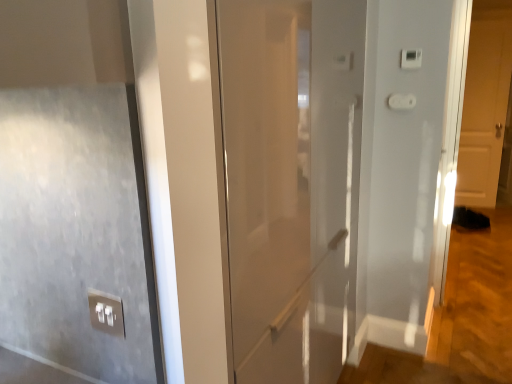
The height and width of the screenshot is (384, 512). What do you see at coordinates (106, 312) in the screenshot? I see `satin silver switch at lower left` at bounding box center [106, 312].

Image resolution: width=512 pixels, height=384 pixels. I want to click on white glossy door at center, which ranks as the first door in front-to-back order, so click(x=291, y=181).

The height and width of the screenshot is (384, 512). What do you see at coordinates (401, 101) in the screenshot?
I see `white plastic light switch at upper right, the 2th light switch in the top-to-bottom sequence` at bounding box center [401, 101].

Describe the element at coordinates (485, 103) in the screenshot. I see `white matte door at right, arranged as the 1th door when viewed from the back` at that location.

This screenshot has height=384, width=512. I want to click on satin silver switch at lower left, so click(106, 312).

From the picture: Is satin silver switch at lower left positioned beyond the bounds of white glossy door at center, marked as the 1th door in a left-to-right arrangement?

satin silver switch at lower left lies outside white glossy door at center, marked as the 1th door in a left-to-right arrangement,'s area.

Consider the image. Can you confirm if satin silver switch at lower left is shorter than white glossy door at center, which ranks as the first door in front-to-back order?

Correct, satin silver switch at lower left is not as tall as white glossy door at center, which ranks as the first door in front-to-back order.

Can you confirm if satin silver switch at lower left is thinner than white glossy door at center, the second door in the back-to-front sequence?

Indeed, satin silver switch at lower left has a lesser width compared to white glossy door at center, the second door in the back-to-front sequence.

Between satin silver switch at lower left and white glossy door at center, which ranks as the first door in front-to-back order, which one has smaller size?

Smaller between the two is satin silver switch at lower left.

Is the depth of satin silver switch at lower left greater than that of white plastic light switch at upper right, the 1th light switch ordered from the bottom?

No, satin silver switch at lower left is in front of white plastic light switch at upper right, the 1th light switch ordered from the bottom.

Measure the distance from satin silver switch at lower left to white plastic light switch at upper right, the 1th light switch ordered from the bottom.

satin silver switch at lower left is 5.67 feet away from white plastic light switch at upper right, the 1th light switch ordered from the bottom.

Is satin silver switch at lower left to the right of white plastic light switch at upper right, the 2th light switch in the top-to-bottom sequence, from the viewer's perspective?

Incorrect, satin silver switch at lower left is not on the right side of white plastic light switch at upper right, the 2th light switch in the top-to-bottom sequence.

Considering the relative sizes of satin silver switch at lower left and white plastic light switch at upper right, acting as the 1th light switch starting from the top, in the image provided, is satin silver switch at lower left smaller than white plastic light switch at upper right, acting as the 1th light switch starting from the top,?

Yes, satin silver switch at lower left is smaller than white plastic light switch at upper right, acting as the 1th light switch starting from the top.

Does point (90, 309) appear closer or farther from the camera than point (409, 57)?

Point (90, 309) appears to be closer to the viewer than point (409, 57).

How different are the orientations of satin silver switch at lower left and white plastic light switch at upper right, acting as the 1th light switch starting from the top, in degrees?

2.52 degrees.

Considering the relative sizes of satin silver switch at lower left and white plastic light switch at upper right, acting as the second light switch starting from the bottom, in the image provided, is satin silver switch at lower left shorter than white plastic light switch at upper right, acting as the second light switch starting from the bottom,?

Yes.

Considering the points (465, 203) and (418, 61), which point is behind, point (465, 203) or point (418, 61)?

The point (465, 203) is farther from the camera.

Image resolution: width=512 pixels, height=384 pixels. In order to click on the 1st door directly beneath the white plastic light switch at upper right, acting as the 1th light switch starting from the top (from a real-world perspective) in this screenshot , I will do point(485,103).

Who is shorter, white matte door at right, arranged as the first door when viewed from the right, or white plastic light switch at upper right, acting as the second light switch starting from the bottom?

Standing shorter between the two is white plastic light switch at upper right, acting as the second light switch starting from the bottom.

Is white matte door at right, arranged as the first door when viewed from the right, turned away from white plastic light switch at upper right, acting as the second light switch starting from the bottom?

No, white plastic light switch at upper right, acting as the second light switch starting from the bottom, is not at the back of white matte door at right, arranged as the first door when viewed from the right.

Can you tell me how much white glossy door at center, the second door in the back-to-front sequence, and white matte door at right, arranged as the first door when viewed from the right, differ in facing direction?

There is a 88.4-degree angle between the facing directions of white glossy door at center, the second door in the back-to-front sequence, and white matte door at right, arranged as the first door when viewed from the right.

Is white glossy door at center, which ranks as the first door in front-to-back order, oriented towards white matte door at right, arranged as the first door when viewed from the right?

No, white glossy door at center, which ranks as the first door in front-to-back order, is not turned towards white matte door at right, arranged as the first door when viewed from the right.

Based on the photo, relative to white matte door at right, arranged as the first door when viewed from the right, is white glossy door at center, which ranks as the first door in front-to-back order, in front or behind?

Clearly, white glossy door at center, which ranks as the first door in front-to-back order, is in front of white matte door at right, arranged as the first door when viewed from the right.

Locate an element on the screen. This screenshot has width=512, height=384. door in front of the white plastic light switch at upper right, acting as the 1th light switch starting from the top is located at coordinates (291, 181).

Could you tell me if white glossy door at center, marked as the 1th door in a left-to-right arrangement, is facing white plastic light switch at upper right, acting as the 1th light switch starting from the top?

No, white glossy door at center, marked as the 1th door in a left-to-right arrangement, is not turned towards white plastic light switch at upper right, acting as the 1th light switch starting from the top.

Is point (232, 148) positioned after point (409, 59)?

No, it is in front of (409, 59).

Is white glossy door at center, which ranks as the first door in front-to-back order, inside or outside of white plastic light switch at upper right, acting as the 1th light switch starting from the top?

white glossy door at center, which ranks as the first door in front-to-back order, is located beyond the bounds of white plastic light switch at upper right, acting as the 1th light switch starting from the top.

Can we say white plastic light switch at upper right, the 2th light switch in the top-to-bottom sequence, lies outside white matte door at right, marked as the 2th door in a front-to-back arrangement?

Yes.

Is white plastic light switch at upper right, the 1th light switch ordered from the bottom, positioned with its back to white matte door at right, marked as the 2th door in a front-to-back arrangement?

Yes, white plastic light switch at upper right, the 1th light switch ordered from the bottom, is positioned with its back facing white matte door at right, marked as the 2th door in a front-to-back arrangement.

How far apart are white plastic light switch at upper right, the 1th light switch ordered from the bottom, and white matte door at right, marked as the 2th door in a front-to-back arrangement?

They are 9.81 feet apart.

From the image's perspective, is white plastic light switch at upper right, the 1th light switch ordered from the bottom, on white matte door at right, marked as the 2th door in a left-to-right arrangement?

No, from the image's perspective, white plastic light switch at upper right, the 1th light switch ordered from the bottom, is not above white matte door at right, marked as the 2th door in a left-to-right arrangement.

Image resolution: width=512 pixels, height=384 pixels. Find the location of `electric outlet to the left of white glossy door at center, which ranks as the first door in front-to-back order`. electric outlet to the left of white glossy door at center, which ranks as the first door in front-to-back order is located at coordinates (106, 312).

Where is `electric outlet below the white plastic light switch at upper right, the 2th light switch in the top-to-bottom sequence (from the image's perspective)`? electric outlet below the white plastic light switch at upper right, the 2th light switch in the top-to-bottom sequence (from the image's perspective) is located at coordinates (106, 312).

Consider the image. Looking at the image, which one is located closer to white plastic light switch at upper right, acting as the second light switch starting from the bottom, satin silver switch at lower left or white glossy door at center, which ranks as the first door in front-to-back order?

white glossy door at center, which ranks as the first door in front-to-back order, is closer to white plastic light switch at upper right, acting as the second light switch starting from the bottom.

When comparing their distances from white glossy door at center, the second door in the back-to-front sequence, does white plastic light switch at upper right, the 2th light switch in the top-to-bottom sequence, or satin silver switch at lower left seem further?

white plastic light switch at upper right, the 2th light switch in the top-to-bottom sequence.

Looking at the image, which one is located closer to white matte door at right, arranged as the first door when viewed from the right, satin silver switch at lower left or white plastic light switch at upper right, the 2th light switch in the top-to-bottom sequence?

The object closer to white matte door at right, arranged as the first door when viewed from the right, is white plastic light switch at upper right, the 2th light switch in the top-to-bottom sequence.

Looking at the image, which one is located closer to white glossy door at center, the second door in the back-to-front sequence, white matte door at right, marked as the 2th door in a front-to-back arrangement, or satin silver switch at lower left?

Among the two, satin silver switch at lower left is located nearer to white glossy door at center, the second door in the back-to-front sequence.

From the image, which object appears to be farther from white matte door at right, arranged as the first door when viewed from the right, white plastic light switch at upper right, the 2th light switch in the top-to-bottom sequence, or white plastic light switch at upper right, acting as the second light switch starting from the bottom?

The object further to white matte door at right, arranged as the first door when viewed from the right, is white plastic light switch at upper right, acting as the second light switch starting from the bottom.

Looking at the image, which one is located closer to white plastic light switch at upper right, acting as the second light switch starting from the bottom, white glossy door at center, marked as the 1th door in a left-to-right arrangement, or white plastic light switch at upper right, the 2th light switch in the top-to-bottom sequence?

Based on the image, white plastic light switch at upper right, the 2th light switch in the top-to-bottom sequence, appears to be nearer to white plastic light switch at upper right, acting as the second light switch starting from the bottom.

From the image, which object appears to be farther from white plastic light switch at upper right, the 1th light switch ordered from the bottom, white matte door at right, marked as the 2th door in a front-to-back arrangement, or white glossy door at center, acting as the second door starting from the right?

white matte door at right, marked as the 2th door in a front-to-back arrangement, lies further to white plastic light switch at upper right, the 1th light switch ordered from the bottom, than the other object.

From the image, which object appears to be farther from white glossy door at center, marked as the 1th door in a left-to-right arrangement, satin silver switch at lower left or white plastic light switch at upper right, acting as the second light switch starting from the bottom?

The object further to white glossy door at center, marked as the 1th door in a left-to-right arrangement, is white plastic light switch at upper right, acting as the second light switch starting from the bottom.

Find the location of a particular element. Image resolution: width=512 pixels, height=384 pixels. electric outlet located between white glossy door at center, which ranks as the first door in front-to-back order, and white plastic light switch at upper right, acting as the second light switch starting from the bottom, in the depth direction is located at coordinates (106, 312).

The image size is (512, 384). Identify the location of light switch between white plastic light switch at upper right, acting as the 1th light switch starting from the top, and white matte door at right, marked as the 2th door in a left-to-right arrangement, from front to back. (401, 101).

Where is `light switch between white glossy door at center, which ranks as the first door in front-to-back order, and white plastic light switch at upper right, the 2th light switch in the top-to-bottom sequence, from front to back`? The height and width of the screenshot is (384, 512). light switch between white glossy door at center, which ranks as the first door in front-to-back order, and white plastic light switch at upper right, the 2th light switch in the top-to-bottom sequence, from front to back is located at coordinates (411, 58).

You are a GUI agent. You are given a task and a screenshot of the screen. Output one action in this format:
    pyautogui.click(x=<x>, y=<y>)
    Task: Click on the electric outlet between white glossy door at center, which ranks as the first door in front-to-back order, and white plastic light switch at upper right, the 2th light switch in the top-to-bottom sequence, along the z-axis
    
    Given the screenshot: What is the action you would take?
    pyautogui.click(x=106, y=312)